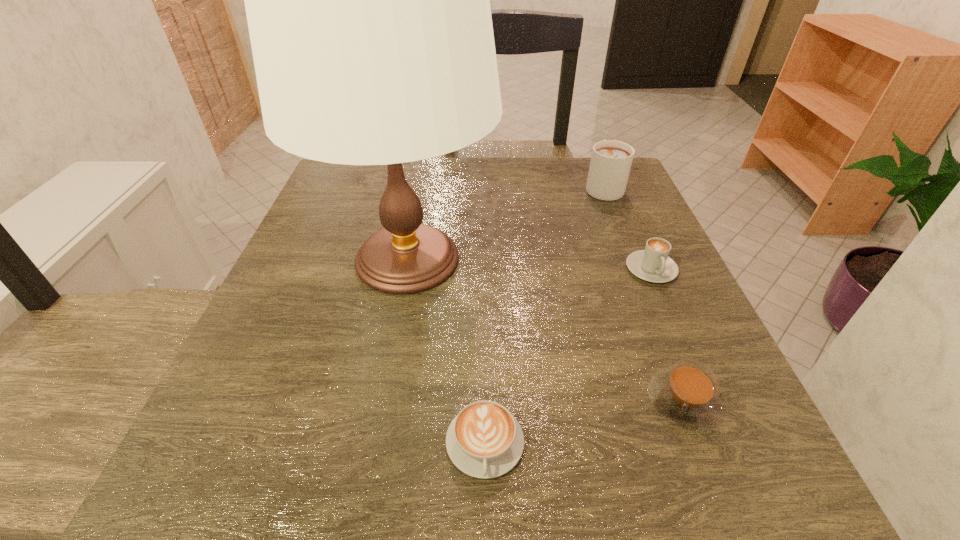
Where is `lamp`? Image resolution: width=960 pixels, height=540 pixels. lamp is located at coordinates (367, 0).

Where is `the farthest object`? the farthest object is located at coordinates [x=611, y=160].

I want to click on the farthest cappuccino, so click(611, 160).

Locate an element on the screen. This screenshot has height=540, width=960. the third nearest cappuccino is located at coordinates (653, 264).

At what (x,y) coordinates should I click in order to perform the action: click on the shortest object. Please return your answer as a coordinate pair (x, y). This screenshot has width=960, height=540. Looking at the image, I should click on (484, 440).

Where is `the leftmost cappuccino`? the leftmost cappuccino is located at coordinates (484, 440).

At what (x,y) coordinates should I click in order to perform the action: click on vacant region located on the right of the tallest object. Please return your answer as a coordinate pair (x, y). Image resolution: width=960 pixels, height=540 pixels. Looking at the image, I should click on (538, 260).

Locate an element on the screen. This screenshot has height=540, width=960. free space located 0.050m on the side with the handle of the tallest cappuccino is located at coordinates (594, 163).

I want to click on vacant space situated on the side with the handle of the tallest cappuccino, so click(594, 163).

In order to click on vacant point located 0.070m on the side with the handle of the tallest cappuccino in this screenshot , I will do `click(592, 159)`.